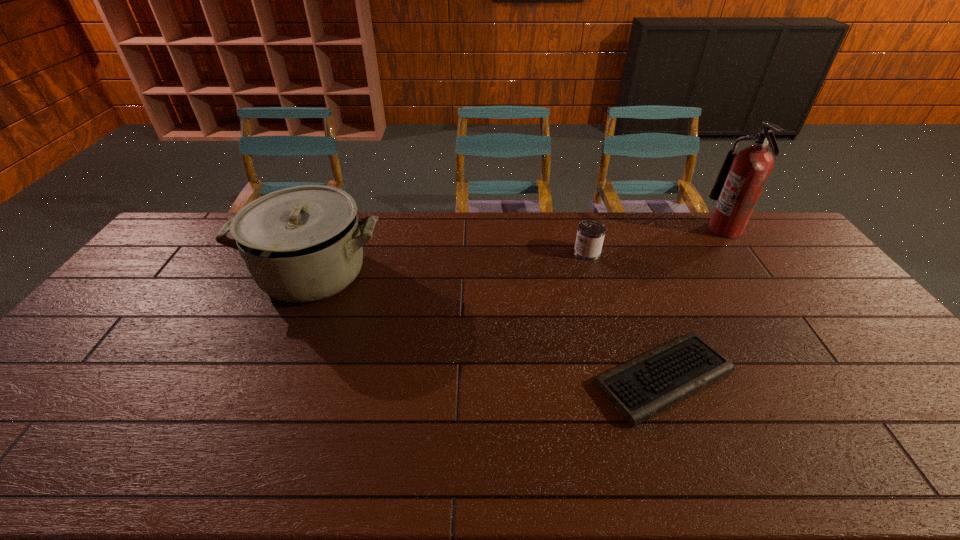
Locate an element on the screen. Image resolution: width=960 pixels, height=540 pixels. fire extinguisher is located at coordinates (741, 180).

Find the location of a particular element. Image resolution: width=960 pixels, height=540 pixels. the rightmost object is located at coordinates (741, 180).

Find the location of a particular element. The height and width of the screenshot is (540, 960). the third shortest object is located at coordinates (301, 244).

Identify the location of saucepan. (301, 244).

Find the location of a particular element. The width and height of the screenshot is (960, 540). the third tallest object is located at coordinates (590, 235).

This screenshot has height=540, width=960. I want to click on the nearest object, so click(x=640, y=389).

This screenshot has width=960, height=540. I want to click on computer keyboard, so tap(640, 389).

Identify the location of vacant space located on the front of the rightmost object near the operation label. (668, 230).

Find the location of `vacant space situated on the front of the rightmost object near the operation label`. vacant space situated on the front of the rightmost object near the operation label is located at coordinates (652, 230).

The width and height of the screenshot is (960, 540). What are the coordinates of `free space located on the front of the rightmost object near the operation label` in the screenshot? It's located at (660, 230).